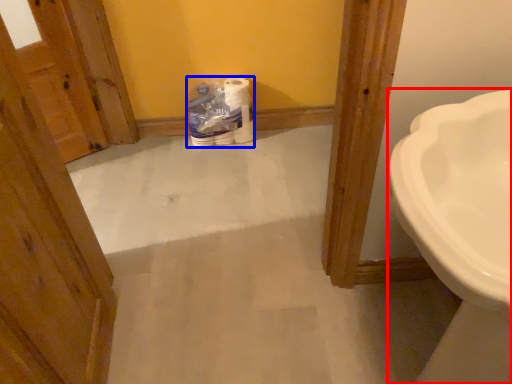
Question: Among these objects, which one is farthest to the camera, sink (highlighted by a red box) or toilet paper (highlighted by a blue box)?

Choices:
 (A) sink
 (B) toilet paper

Answer: (B)